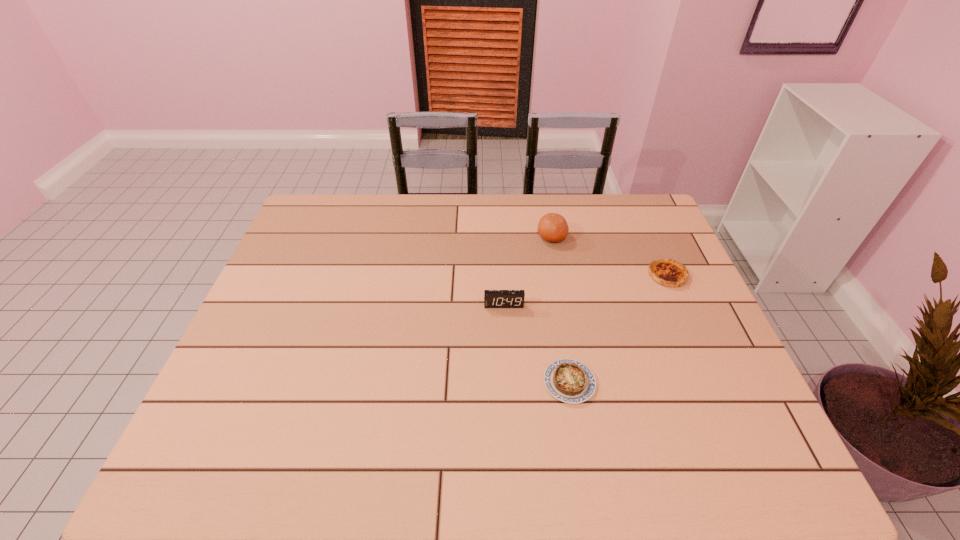
Where is `the tallest object`? Image resolution: width=960 pixels, height=540 pixels. the tallest object is located at coordinates (552, 227).

Identify the location of clementine. The height and width of the screenshot is (540, 960). (552, 227).

I want to click on the third farthest object, so click(492, 298).

The height and width of the screenshot is (540, 960). Find the location of `the third shortest object`. the third shortest object is located at coordinates (492, 298).

You are a GUI agent. You are given a task and a screenshot of the screen. Output one action in this format:
    pyautogui.click(x=<x>, y=<y>)
    Task: Click on the second farthest object
    
    Given the screenshot: What is the action you would take?
    pyautogui.click(x=669, y=273)

Locate an element on the screen. the farther quiche is located at coordinates coord(669,273).

The width and height of the screenshot is (960, 540). Identify the location of the nearest object. (570, 381).

Identify the location of the left quiche. This screenshot has width=960, height=540. (570, 381).

Identify the location of vacant area situated 0.360m on the front of the farthest object. The height and width of the screenshot is (540, 960). (570, 338).

Image resolution: width=960 pixels, height=540 pixels. What are the coordinates of `blank space located 0.260m on the front-facing side of the leftmost object` in the screenshot? It's located at (508, 392).